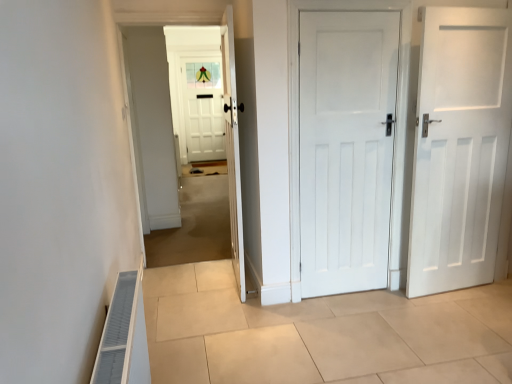
Where is `free space that is to the left of white painted wood door at center, the second door when ordered from right to left`? free space that is to the left of white painted wood door at center, the second door when ordered from right to left is located at coordinates (298, 309).